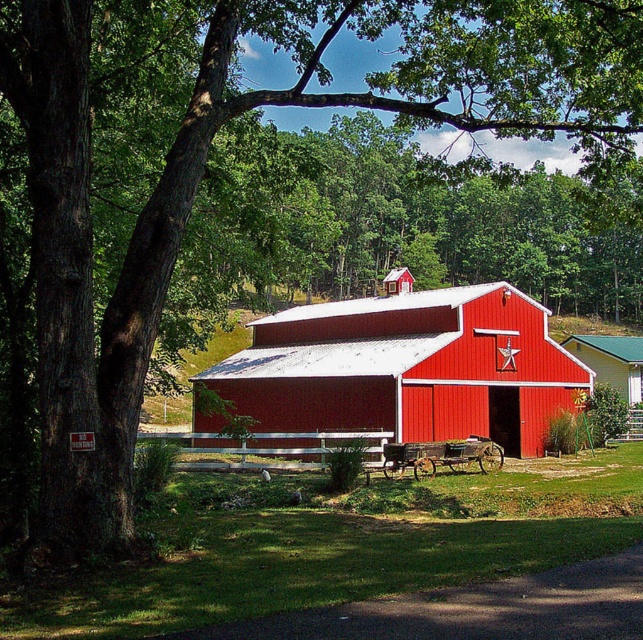
Question: In this image, where is smooth red barn at center located relative to red matte barn at center?

Choices:
 (A) below
 (B) above

Answer: (B)

Question: Which object is closer to the camera taking this photo?

Choices:
 (A) smooth red barn at center
 (B) red matte barn at center

Answer: (A)

Question: Does smooth red barn at center have a greater width compared to red matte barn at center?

Choices:
 (A) yes
 (B) no

Answer: (A)

Question: Which object is closer to the camera taking this photo?

Choices:
 (A) smooth red barn at center
 (B) red matte barn at center

Answer: (A)

Question: Is smooth red barn at center below red matte barn at center?

Choices:
 (A) no
 (B) yes

Answer: (A)